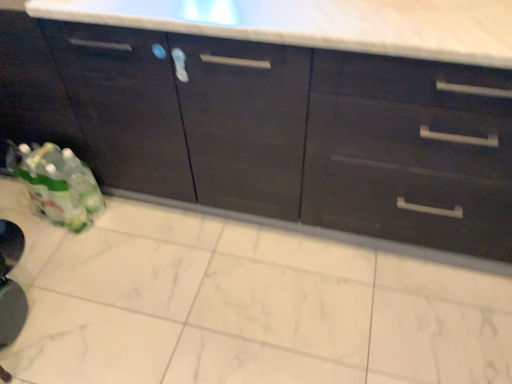
Identify the location of matte dark wood cabinets at center, acting as the first cabinetry starting from the right. (296, 114).

The height and width of the screenshot is (384, 512). What do you see at coordinates (296, 114) in the screenshot?
I see `matte dark wood cabinets at center, acting as the first cabinetry starting from the right` at bounding box center [296, 114].

Describe the element at coordinates (125, 105) in the screenshot. I see `matte black cabinet at lower left, which is the second cabinetry from right to left` at that location.

The width and height of the screenshot is (512, 384). In order to click on matte black cabinet at lower left, which is the first cabinetry from left to right in this screenshot , I will do `click(125, 105)`.

At what (x,y) coordinates should I click in order to perform the action: click on matte dark wood cabinets at center, positioned as the second cabinetry in left-to-right order. Please return your answer as a coordinate pair (x, y). Looking at the image, I should click on (296, 114).

Considering the positions of objects matte dark wood cabinets at center, acting as the first cabinetry starting from the right, and matte black cabinet at lower left, which is the second cabinetry from right to left, in the image provided, who is more to the left, matte dark wood cabinets at center, acting as the first cabinetry starting from the right, or matte black cabinet at lower left, which is the second cabinetry from right to left,?

Positioned to the left is matte black cabinet at lower left, which is the second cabinetry from right to left.

Which object is more forward, matte dark wood cabinets at center, acting as the first cabinetry starting from the right, or matte black cabinet at lower left, which is the second cabinetry from right to left?

matte dark wood cabinets at center, acting as the first cabinetry starting from the right.

Considering the points (375, 4) and (109, 150), which point is in front, point (375, 4) or point (109, 150)?

The point (375, 4) is closer.

From the image's perspective, which one is positioned higher, matte dark wood cabinets at center, acting as the first cabinetry starting from the right, or matte black cabinet at lower left, which is the second cabinetry from right to left?

matte black cabinet at lower left, which is the second cabinetry from right to left, is shown above in the image.

From a real-world perspective, is matte dark wood cabinets at center, acting as the first cabinetry starting from the right, located beneath matte black cabinet at lower left, which is the first cabinetry from left to right?

Yes, from a real-world perspective, matte dark wood cabinets at center, acting as the first cabinetry starting from the right, is beneath matte black cabinet at lower left, which is the first cabinetry from left to right.

Between matte dark wood cabinets at center, positioned as the second cabinetry in left-to-right order, and matte black cabinet at lower left, which is the first cabinetry from left to right, which one has smaller width?

Thinner between the two is matte dark wood cabinets at center, positioned as the second cabinetry in left-to-right order.

Is matte dark wood cabinets at center, positioned as the second cabinetry in left-to-right order, taller or shorter than matte black cabinet at lower left, which is the second cabinetry from right to left?

Clearly, matte dark wood cabinets at center, positioned as the second cabinetry in left-to-right order, is taller compared to matte black cabinet at lower left, which is the second cabinetry from right to left.

Considering the relative sizes of matte dark wood cabinets at center, positioned as the second cabinetry in left-to-right order, and matte black cabinet at lower left, which is the first cabinetry from left to right, in the image provided, is matte dark wood cabinets at center, positioned as the second cabinetry in left-to-right order, bigger than matte black cabinet at lower left, which is the first cabinetry from left to right,?

Indeed, matte dark wood cabinets at center, positioned as the second cabinetry in left-to-right order, has a larger size compared to matte black cabinet at lower left, which is the first cabinetry from left to right.

Is matte dark wood cabinets at center, positioned as the second cabinetry in left-to-right order, inside or outside of matte black cabinet at lower left, which is the second cabinetry from right to left?

matte dark wood cabinets at center, positioned as the second cabinetry in left-to-right order, is outside matte black cabinet at lower left, which is the second cabinetry from right to left.

Is matte dark wood cabinets at center, acting as the first cabinetry starting from the right, positioned far away from matte black cabinet at lower left, which is the first cabinetry from left to right?

No, matte dark wood cabinets at center, acting as the first cabinetry starting from the right, is not far away from matte black cabinet at lower left, which is the first cabinetry from left to right.

Is matte dark wood cabinets at center, acting as the first cabinetry starting from the right, facing towards matte black cabinet at lower left, which is the first cabinetry from left to right?

No, matte dark wood cabinets at center, acting as the first cabinetry starting from the right, is not oriented towards matte black cabinet at lower left, which is the first cabinetry from left to right.

How different are the orientations of matte dark wood cabinets at center, positioned as the second cabinetry in left-to-right order, and matte black cabinet at lower left, which is the second cabinetry from right to left, in degrees?

matte dark wood cabinets at center, positioned as the second cabinetry in left-to-right order, and matte black cabinet at lower left, which is the second cabinetry from right to left, are facing 1.69 degrees away from each other.

Image resolution: width=512 pixels, height=384 pixels. I want to click on cabinetry above the matte dark wood cabinets at center, positioned as the second cabinetry in left-to-right order (from a real-world perspective), so click(125, 105).

Considering the relative positions of matte black cabinet at lower left, which is the second cabinetry from right to left, and matte dark wood cabinets at center, acting as the first cabinetry starting from the right, in the image provided, is matte black cabinet at lower left, which is the second cabinetry from right to left, to the right of matte dark wood cabinets at center, acting as the first cabinetry starting from the right, from the viewer's perspective?

In fact, matte black cabinet at lower left, which is the second cabinetry from right to left, is to the left of matte dark wood cabinets at center, acting as the first cabinetry starting from the right.

Which object is closer to the camera, matte black cabinet at lower left, which is the second cabinetry from right to left, or matte dark wood cabinets at center, acting as the first cabinetry starting from the right?

matte dark wood cabinets at center, acting as the first cabinetry starting from the right.

Considering the points (60, 30) and (312, 216), which point is in front, point (60, 30) or point (312, 216)?

The point (60, 30) is more forward.

From the image's perspective, which one is positioned lower, matte black cabinet at lower left, which is the second cabinetry from right to left, or matte dark wood cabinets at center, acting as the first cabinetry starting from the right?

matte dark wood cabinets at center, acting as the first cabinetry starting from the right.

From a real-world perspective, is matte black cabinet at lower left, which is the second cabinetry from right to left, under matte dark wood cabinets at center, positioned as the second cabinetry in left-to-right order?

No, from a real-world perspective, matte black cabinet at lower left, which is the second cabinetry from right to left, is not below matte dark wood cabinets at center, positioned as the second cabinetry in left-to-right order.

Considering the sizes of objects matte black cabinet at lower left, which is the second cabinetry from right to left, and matte dark wood cabinets at center, positioned as the second cabinetry in left-to-right order, in the image provided, who is wider, matte black cabinet at lower left, which is the second cabinetry from right to left, or matte dark wood cabinets at center, positioned as the second cabinetry in left-to-right order,?

matte black cabinet at lower left, which is the second cabinetry from right to left.

Who is taller, matte black cabinet at lower left, which is the second cabinetry from right to left, or matte dark wood cabinets at center, acting as the first cabinetry starting from the right?

matte dark wood cabinets at center, acting as the first cabinetry starting from the right, is taller.

Who is smaller, matte black cabinet at lower left, which is the second cabinetry from right to left, or matte dark wood cabinets at center, positioned as the second cabinetry in left-to-right order?

matte black cabinet at lower left, which is the second cabinetry from right to left.

Is matte black cabinet at lower left, which is the first cabinetry from left to right, surrounding matte dark wood cabinets at center, positioned as the second cabinetry in left-to-right order?

No, matte dark wood cabinets at center, positioned as the second cabinetry in left-to-right order, is not inside matte black cabinet at lower left, which is the first cabinetry from left to right.

Is matte black cabinet at lower left, which is the second cabinetry from right to left, with matte dark wood cabinets at center, acting as the first cabinetry starting from the right?

They are not placed beside each other.

Does matte black cabinet at lower left, which is the second cabinetry from right to left, turn towards matte dark wood cabinets at center, positioned as the second cabinetry in left-to-right order?

No, matte black cabinet at lower left, which is the second cabinetry from right to left, is not turned towards matte dark wood cabinets at center, positioned as the second cabinetry in left-to-right order.

Measure the distance between matte black cabinet at lower left, which is the first cabinetry from left to right, and matte dark wood cabinets at center, acting as the first cabinetry starting from the right.

The distance of matte black cabinet at lower left, which is the first cabinetry from left to right, from matte dark wood cabinets at center, acting as the first cabinetry starting from the right, is 9.17 inches.

This screenshot has height=384, width=512. Identify the location of cabinetry behind the matte dark wood cabinets at center, positioned as the second cabinetry in left-to-right order. (125, 105).

At what (x,y) coordinates should I click in order to perform the action: click on cabinetry behind the matte dark wood cabinets at center, positioned as the second cabinetry in left-to-right order. Please return your answer as a coordinate pair (x, y). Image resolution: width=512 pixels, height=384 pixels. Looking at the image, I should click on (125, 105).

Find the location of a particular element. This screenshot has height=384, width=512. cabinetry on the left side of matte dark wood cabinets at center, positioned as the second cabinetry in left-to-right order is located at coordinates (125, 105).